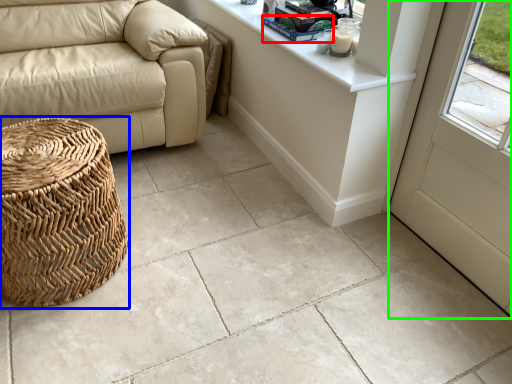
Question: Which object is the closest to the book (highlighted by a red box)? Choose among these: basket (highlighted by a blue box) or screen door (highlighted by a green box).

Choices:
 (A) basket
 (B) screen door

Answer: (B)